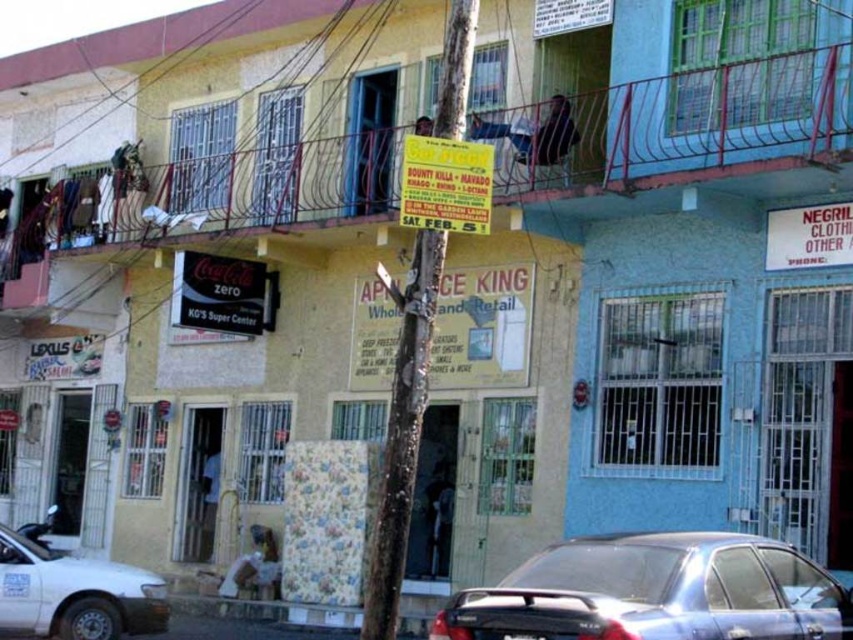
Question: Does metallic blue sedan at lower center appear on the left side of white matte car at lower left?

Choices:
 (A) yes
 (B) no

Answer: (B)

Question: Which of the following is the farthest from the observer?

Choices:
 (A) (99, 608)
 (B) (703, 621)

Answer: (A)

Question: Can you confirm if metallic blue sedan at lower center is positioned below white matte car at lower left?

Choices:
 (A) no
 (B) yes

Answer: (A)

Question: Does metallic blue sedan at lower center have a smaller size compared to white matte car at lower left?

Choices:
 (A) yes
 (B) no

Answer: (B)